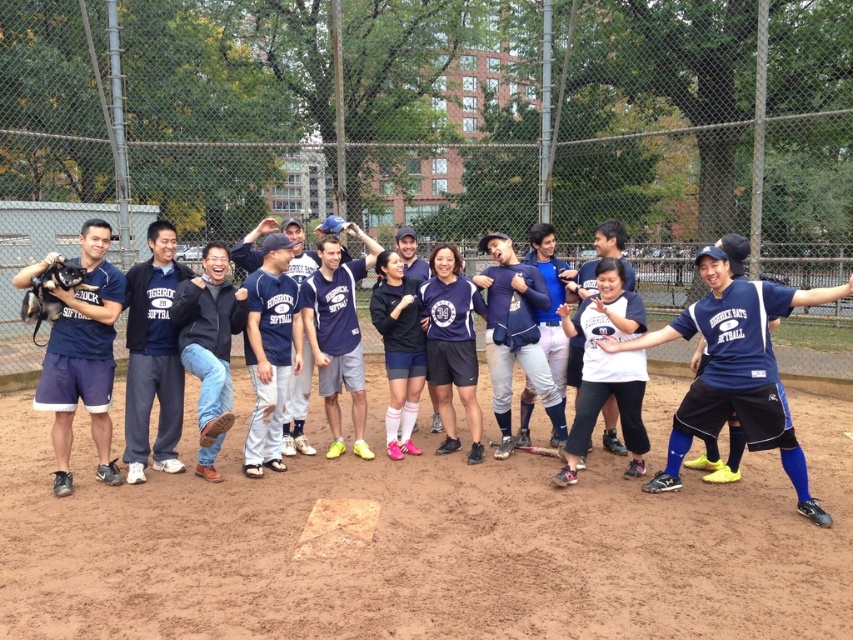
Question: Which of these objects is positioned farthest from the blue jersey at center?

Choices:
 (A) matte blue shorts at left
 (B) dark brown leather glove at left

Answer: (B)

Question: Is blue jersey at center wider than matte blue shorts at left?

Choices:
 (A) no
 (B) yes

Answer: (B)

Question: Considering the relative positions of matte blue shorts at left and dark blue sweatshirt at center in the image provided, where is matte blue shorts at left located with respect to dark blue sweatshirt at center?

Choices:
 (A) below
 (B) above

Answer: (A)

Question: Among these objects, which one is nearest to the camera?

Choices:
 (A) black matte jacket at center
 (B) dark brown leather glove at left

Answer: (A)

Question: Which object is the farthest from the dark blue sweatshirt at center?

Choices:
 (A) navy blue jersey at center
 (B) matte blue shorts at left
 (C) blue jersey at center

Answer: (C)

Question: Can you confirm if dark blue sweatshirt at center is smaller than dark brown leather glove at left?

Choices:
 (A) yes
 (B) no

Answer: (B)